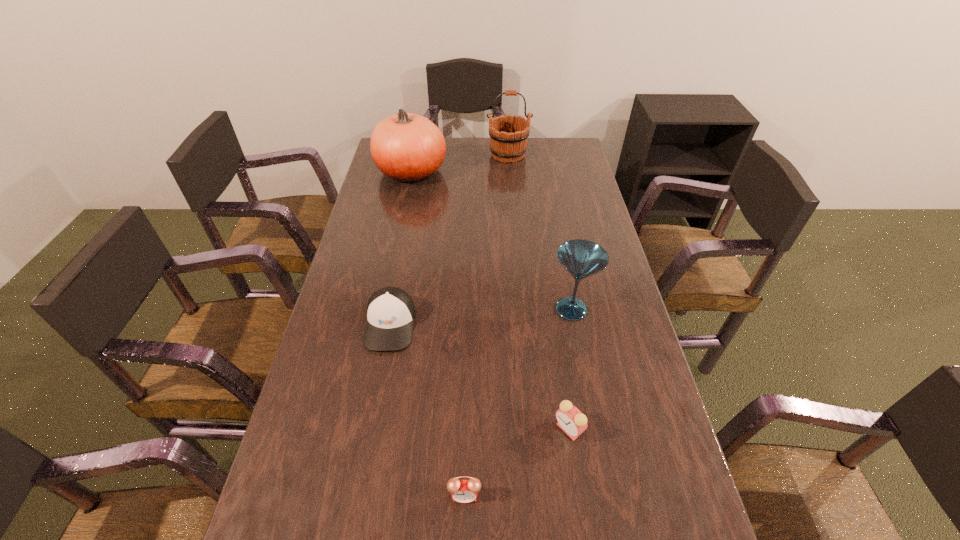
The height and width of the screenshot is (540, 960). I want to click on object that is at the far left corner, so click(407, 147).

Image resolution: width=960 pixels, height=540 pixels. What are the coordinates of `free point at the far edge` in the screenshot? It's located at (468, 164).

Find the location of `free location at the left edge`. free location at the left edge is located at coordinates (263, 519).

The height and width of the screenshot is (540, 960). Identify the location of vacant space at the right edge of the desktop. click(598, 401).

Find the location of a particular element. This screenshot has height=540, width=960. blank region between the fifth farthest object and the nearer alarm clock is located at coordinates (516, 462).

Locate an element on the screen. vacant space in between the third object from left to right and the cap is located at coordinates (427, 410).

Identify the location of free spot between the right alarm clock and the cap. (480, 376).

At what (x,y) coordinates should I click in order to perform the action: click on free space between the second nearest object and the wine bucket. Please return your answer as a coordinate pair (x, y). This screenshot has height=540, width=960. Looking at the image, I should click on (539, 292).

The image size is (960, 540). I want to click on vacant space in between the fourth shortest object and the wine bucket, so click(x=540, y=232).

Identify the location of free space between the wine bucket and the right alarm clock. (539, 292).